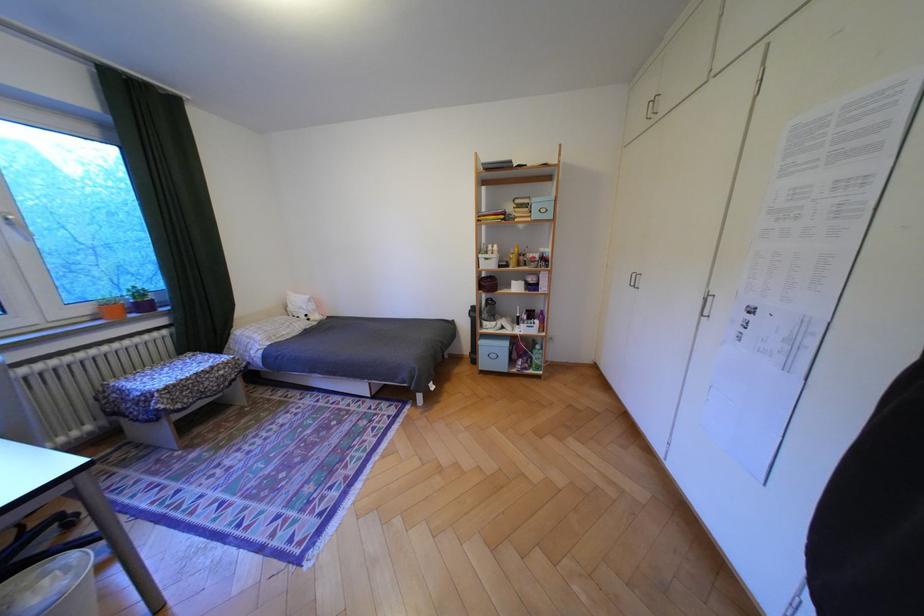
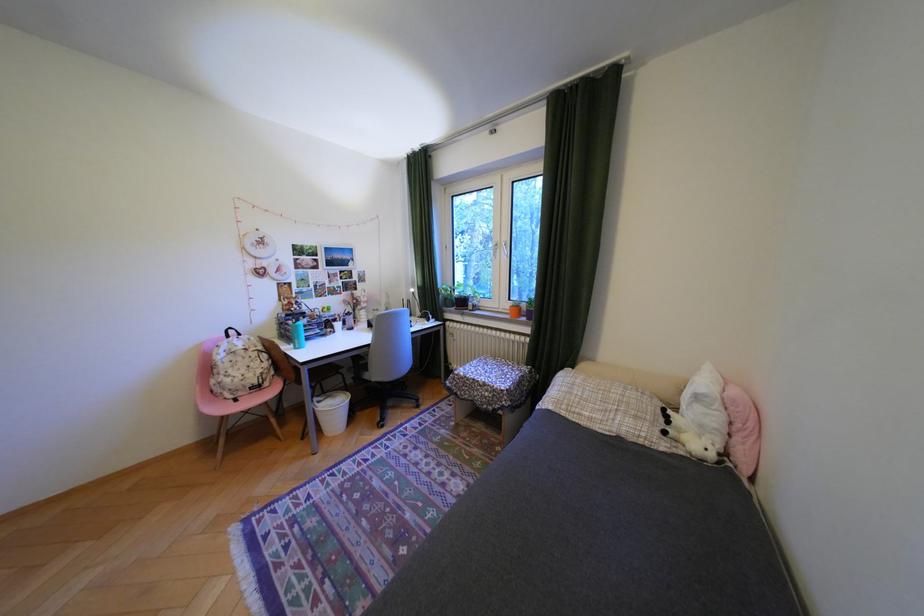
Locate, in the second image, the point that corresponds to point 190,406 in the first image.

(470, 392)